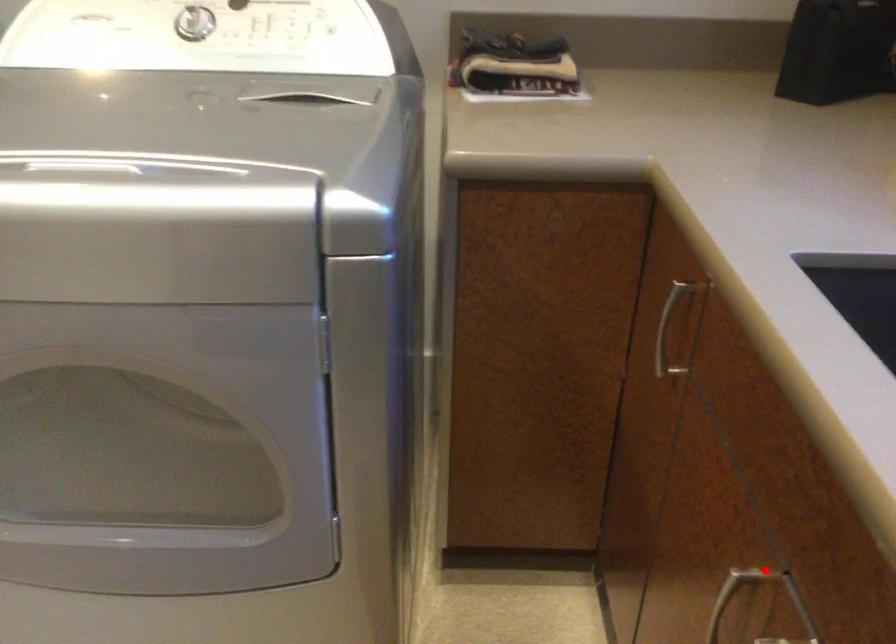
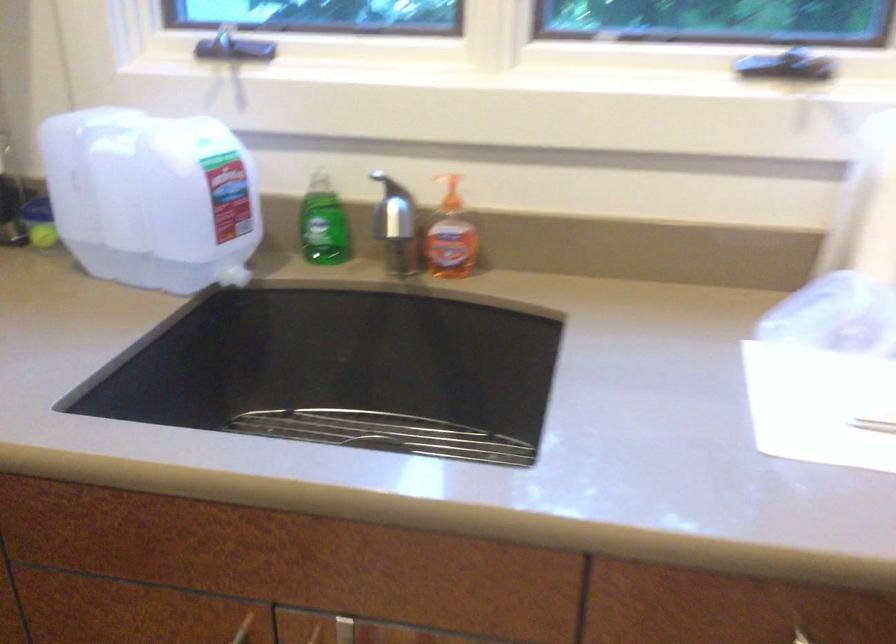
Question: I am providing you with two images of the same scene from different viewpoints. A red point is marked on the first image. Can you still see the location of the red point in image 2?

Choices:
 (A) Yes
 (B) No

Answer: (A)